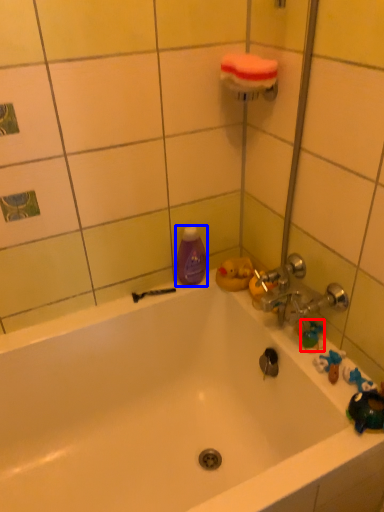
Question: Which point is further to the camera, toy (highlighted by a red box) or cleaning product (highlighted by a blue box)?

Choices:
 (A) toy
 (B) cleaning product

Answer: (B)